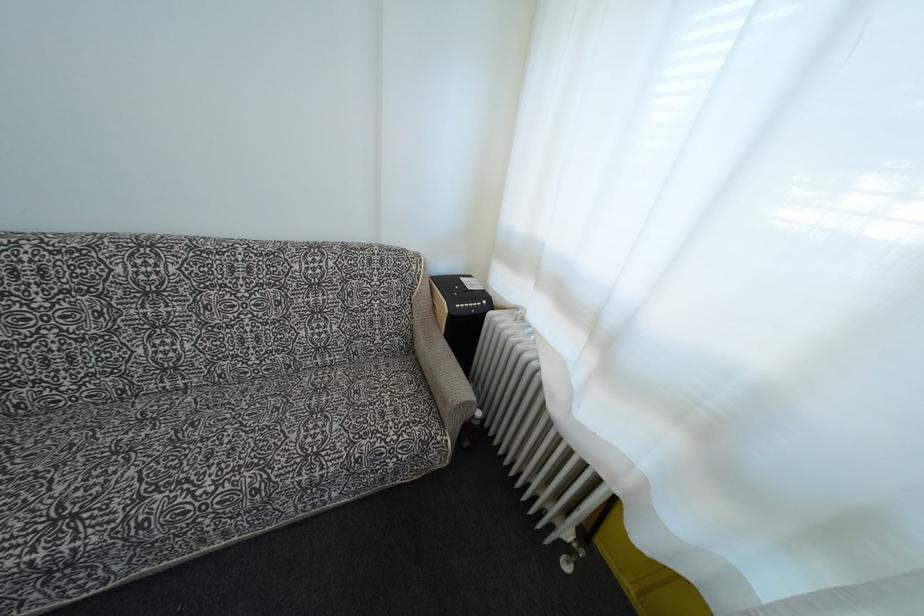
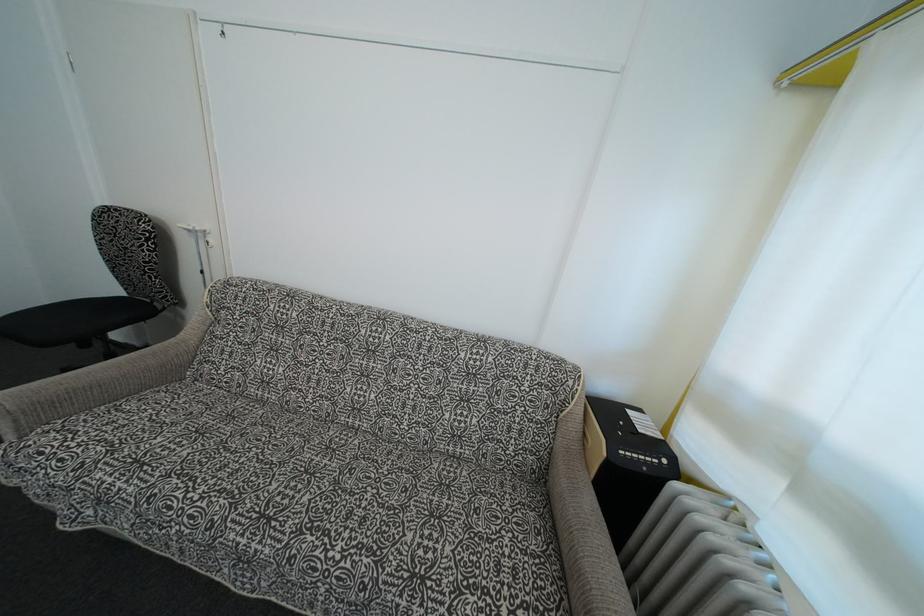
Question: The images are taken continuously from a first-person perspective. In which direction is your viewpoint rotating?

Choices:
 (A) Left
 (B) Right
 (C) Up
 (D) Down

Answer: (A)